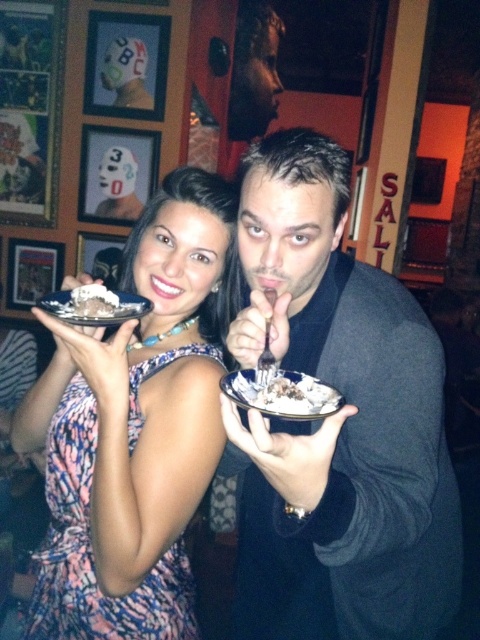
You are a photographer at a social event. You want to capture a closeup shot of the white creamy dessert at center and the silver metallic plate at left. Which object should you focus on first if you want to ensure both are in focus without adjusting the camera settings?

The white creamy dessert at center has a lesser height compared to silver metallic plate at left, so you should focus on the silver metallic plate at left first since it is farther away and requires a greater depth of field to keep both in focus.

You are at a party and want to take a photo with the matte pink dress at center and the silver metallic plate at left. If you want to make sure both are clearly visible, which object should you focus on first?

The matte pink dress at center is larger than the silver metallic plate at left, so you should focus on the matte pink dress at center first to ensure it is in clear focus before adjusting for the smaller plate.

From the picture: You are a photographer at a social event and want to capture a closeup of the cake on the plate. Which object should you focus on first, the white ceramic plate at center or the chocolate cake at center?

The white ceramic plate at center is below the chocolate cake at center, so you should focus on the chocolate cake at center first as it is higher up.